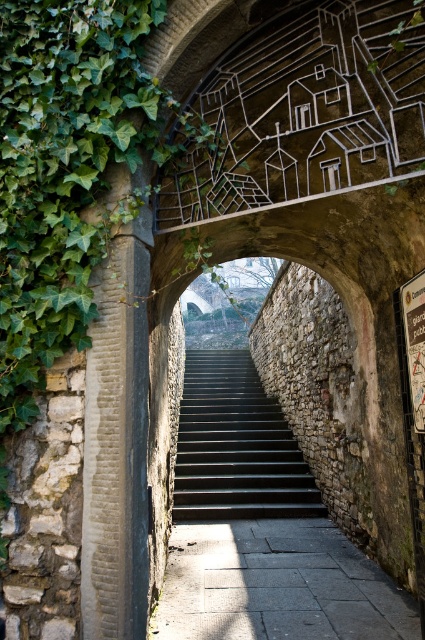
Question: Does gray concrete path at center lie behind dark gray stone stairs at center?

Choices:
 (A) yes
 (B) no

Answer: (B)

Question: Can you confirm if gray concrete path at center is positioned above dark gray stone stairs at center?

Choices:
 (A) yes
 (B) no

Answer: (B)

Question: Does gray concrete path at center have a smaller size compared to dark gray stone stairs at center?

Choices:
 (A) no
 (B) yes

Answer: (B)